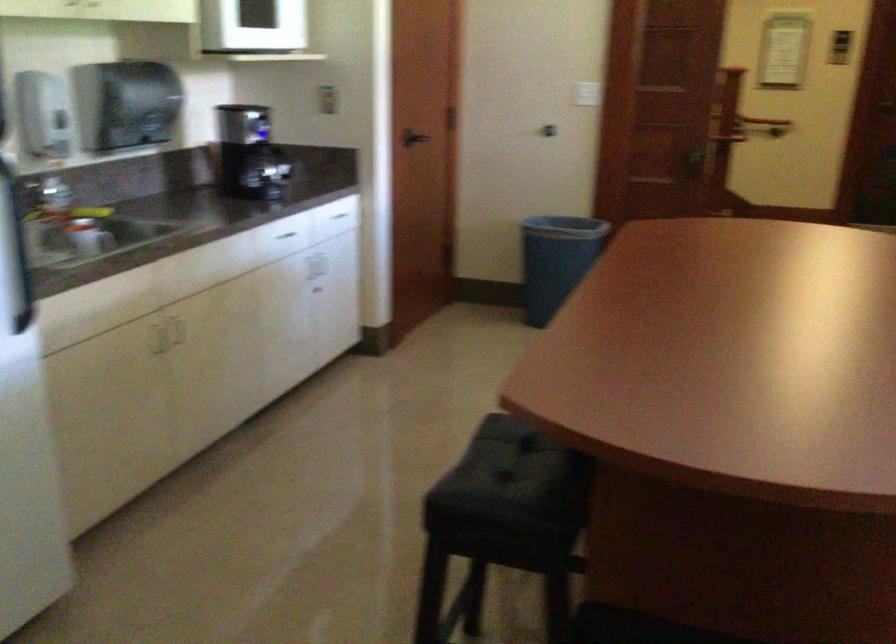
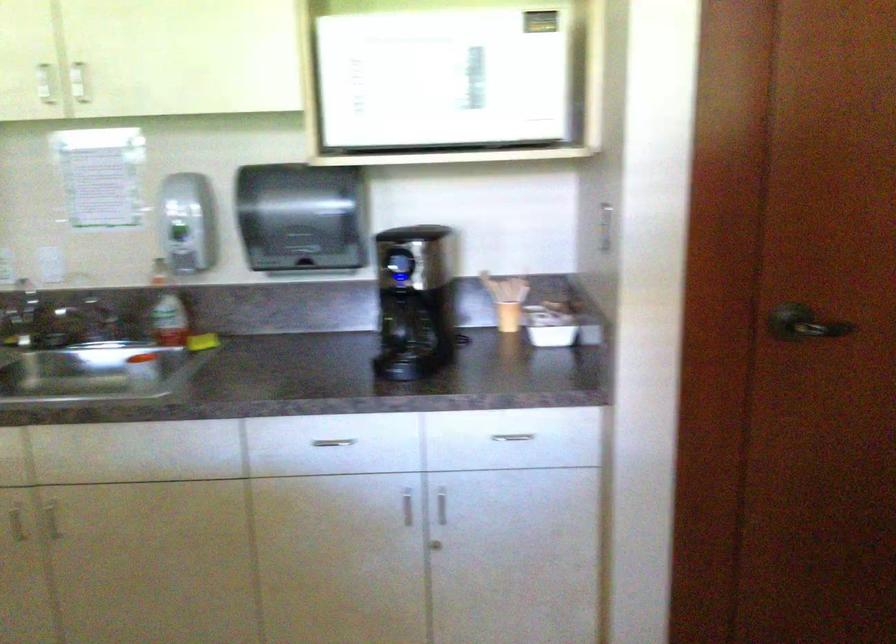
The point at (336,216) is marked in the first image. Where is the corresponding point in the second image?

(512, 437)